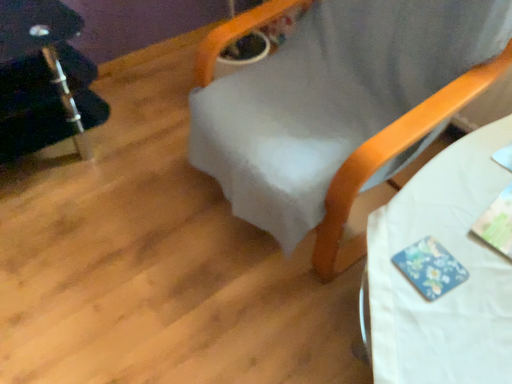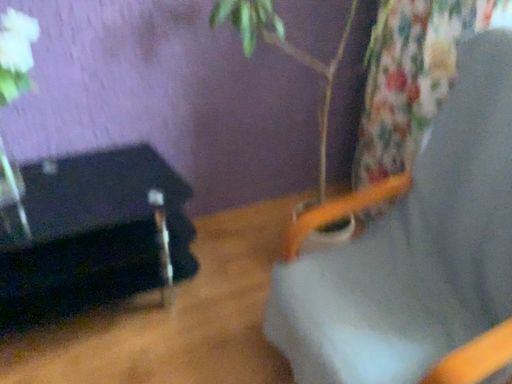
Question: Which way did the camera rotate in the video?

Choices:
 (A) rotated upward
 (B) rotated downward

Answer: (A)